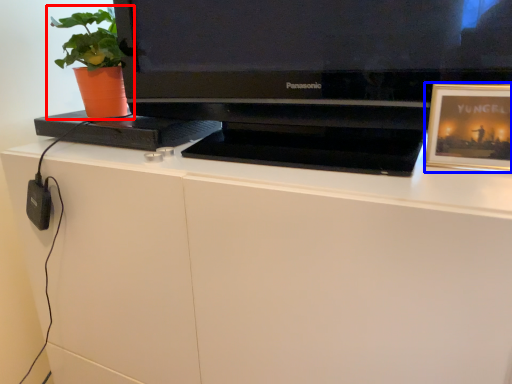
Question: Among these objects, which one is nearest to the camera, houseplant (highlighted by a red box) or picture frame (highlighted by a blue box)?

Choices:
 (A) houseplant
 (B) picture frame

Answer: (B)